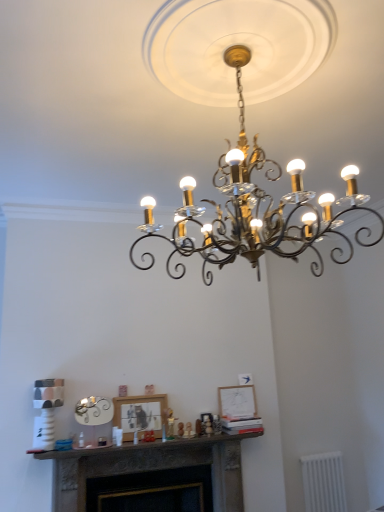
Question: From a real-world perspective, is white plastic radiator at lower right beneath matte white picture frame at center, which ranks as the 2th picture frame in front-to-back order?

Choices:
 (A) yes
 (B) no

Answer: (A)

Question: Is white plastic radiator at lower right aimed at matte white picture frame at center, which ranks as the 2th picture frame in front-to-back order?

Choices:
 (A) no
 (B) yes

Answer: (A)

Question: Does white plastic radiator at lower right appear on the left side of matte white picture frame at center, placed as the 1th picture frame when sorted from back to front?

Choices:
 (A) yes
 (B) no

Answer: (B)

Question: From the image's perspective, is white plastic radiator at lower right over matte white picture frame at center, which appears as the 1th picture frame when viewed from the right?

Choices:
 (A) yes
 (B) no

Answer: (B)

Question: Considering the relative positions of white plastic radiator at lower right and matte white picture frame at center, placed as the 1th picture frame when sorted from back to front, in the image provided, is white plastic radiator at lower right to the right of matte white picture frame at center, placed as the 1th picture frame when sorted from back to front, from the viewer's perspective?

Choices:
 (A) no
 (B) yes

Answer: (B)

Question: Is point (140, 404) positioned closer to the camera than point (264, 199)?

Choices:
 (A) farther
 (B) closer

Answer: (A)

Question: From a real-world perspective, is matte black picture frame at center, the 1th picture frame positioned from the left, positioned above or below black wrought iron chandelier at center?

Choices:
 (A) above
 (B) below

Answer: (B)

Question: In the image, is matte black picture frame at center, marked as the 1th picture frame in a front-to-back arrangement, on the left side or the right side of black wrought iron chandelier at center?

Choices:
 (A) left
 (B) right

Answer: (A)

Question: Considering the positions of matte black picture frame at center, the 1th picture frame positioned from the left, and black wrought iron chandelier at center in the image, is matte black picture frame at center, the 1th picture frame positioned from the left, wider or thinner than black wrought iron chandelier at center?

Choices:
 (A) wide
 (B) thin

Answer: (B)

Question: Considering the positions of point (233, 389) and point (193, 480), is point (233, 389) closer or farther from the camera than point (193, 480)?

Choices:
 (A) closer
 (B) farther

Answer: (B)

Question: Is matte white picture frame at center, which ranks as the 2th picture frame in front-to-back order, in front of or behind dark gray stone fireplace at center in the image?

Choices:
 (A) front
 (B) behind

Answer: (B)

Question: Would you say matte white picture frame at center, which is counted as the 2th picture frame, starting from the left, is to the left or to the right of dark gray stone fireplace at center in the picture?

Choices:
 (A) left
 (B) right

Answer: (B)

Question: Is matte white picture frame at center, placed as the 1th picture frame when sorted from back to front, spatially inside dark gray stone fireplace at center, or outside of it?

Choices:
 (A) outside
 (B) inside

Answer: (A)

Question: From the image's perspective, relative to matte black picture frame at center, positioned as the second picture frame in back-to-front order, is white plastic radiator at lower right above or below?

Choices:
 (A) below
 (B) above

Answer: (A)

Question: Is white plastic radiator at lower right taller or shorter than matte black picture frame at center, positioned as the second picture frame in back-to-front order?

Choices:
 (A) tall
 (B) short

Answer: (A)